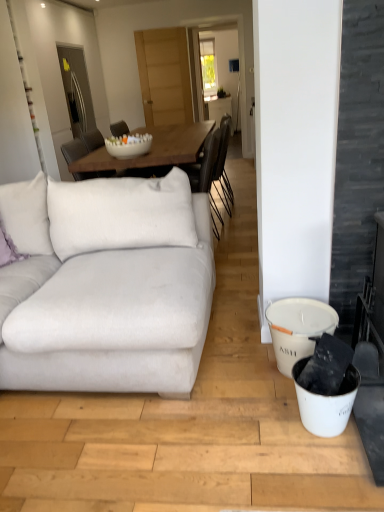
Question: Does white glossy bowl at center turn towards white matte bucket at lower right?

Choices:
 (A) no
 (B) yes

Answer: (A)

Question: Can you confirm if white glossy bowl at center is shorter than white matte bucket at lower right?

Choices:
 (A) yes
 (B) no

Answer: (A)

Question: From a real-world perspective, is white glossy bowl at center located beneath white matte bucket at lower right?

Choices:
 (A) no
 (B) yes

Answer: (A)

Question: Does white glossy bowl at center have a larger size compared to white matte bucket at lower right?

Choices:
 (A) yes
 (B) no

Answer: (B)

Question: Would you say white glossy bowl at center is a long distance from white matte bucket at lower right?

Choices:
 (A) no
 (B) yes

Answer: (B)

Question: From a real-world perspective, is white fabric couch at left above or below white matte bucket at lower right?

Choices:
 (A) below
 (B) above

Answer: (B)

Question: Based on their sizes in the image, would you say white fabric couch at left is bigger or smaller than white matte bucket at lower right?

Choices:
 (A) big
 (B) small

Answer: (A)

Question: Considering their positions, is white fabric couch at left located in front of or behind white matte bucket at lower right?

Choices:
 (A) front
 (B) behind

Answer: (A)

Question: From the image's perspective, relative to white matte bucket at lower right, is white fabric couch at left above or below?

Choices:
 (A) above
 (B) below

Answer: (A)

Question: In the image, is white fabric couch at left positioned in front of or behind white glossy bowl at center?

Choices:
 (A) behind
 (B) front

Answer: (B)

Question: Considering the positions of point (167, 227) and point (140, 155), is point (167, 227) closer or farther from the camera than point (140, 155)?

Choices:
 (A) farther
 (B) closer

Answer: (B)

Question: Visually, is white fabric couch at left positioned to the left or to the right of white glossy bowl at center?

Choices:
 (A) right
 (B) left

Answer: (A)

Question: From a real-world perspective, is white fabric couch at left physically located above or below white glossy bowl at center?

Choices:
 (A) above
 (B) below

Answer: (B)

Question: Is purple velvet pillow at left in front of or behind white glossy bowl at center in the image?

Choices:
 (A) behind
 (B) front

Answer: (B)

Question: Is point (3, 225) positioned closer to the camera than point (112, 142)?

Choices:
 (A) closer
 (B) farther

Answer: (A)